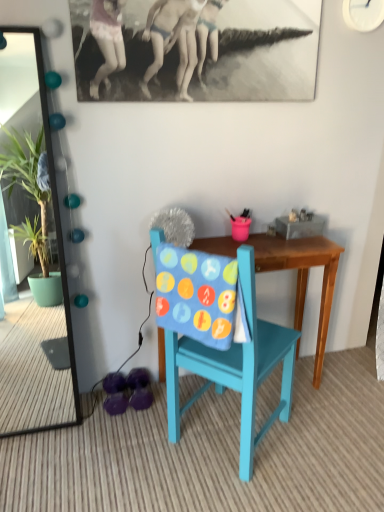
Locate an element on the screen. vacant space to the right of wooden table at center is located at coordinates (342, 398).